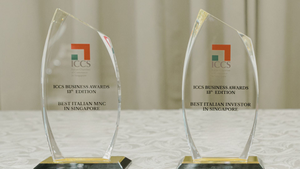
Locate an element on the screen. stand is located at coordinates (187, 156).